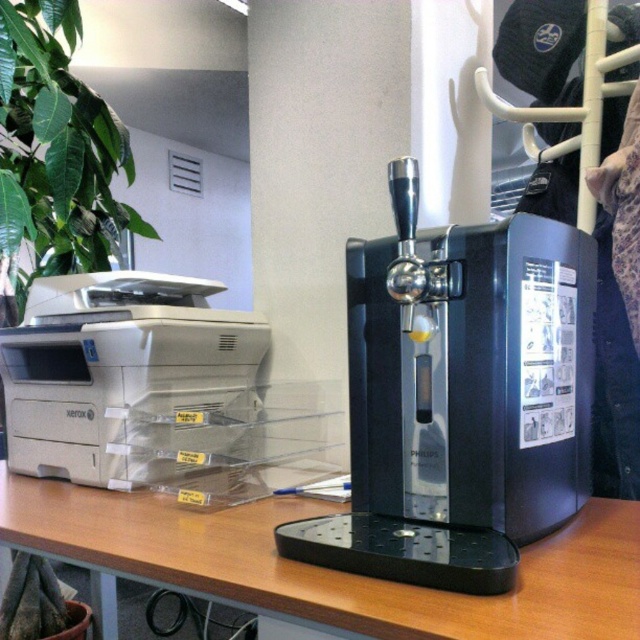
Is brown wood table at center wider than green leafy plant at upper left?

Yes.

Consider the image. Between brown wood table at center and green leafy plant at upper left, which one appears on the left side from the viewer's perspective?

From the viewer's perspective, green leafy plant at upper left appears more on the left side.

Is point (321, 611) positioned after point (106, 184)?

No, (321, 611) is in front of (106, 184).

Find the location of a particular element. brown wood table at center is located at coordinates (326, 568).

The height and width of the screenshot is (640, 640). What do you see at coordinates (460, 397) in the screenshot?
I see `black plastic coffee machine at center` at bounding box center [460, 397].

Can you confirm if black plastic coffee machine at center is thinner than matte gray printer at left?

Yes, black plastic coffee machine at center is thinner than matte gray printer at left.

Is point (371, 410) positioned behind point (147, 273)?

That is False.

Find the location of a particular element. This screenshot has height=640, width=640. black plastic coffee machine at center is located at coordinates (460, 397).

Is black plastic coffee machine at center taller than brown wood table at center?

Yes.

Who is more distant from viewer, (419, 497) or (445, 600)?

Point (419, 497)

Find the location of a particular element. black plastic coffee machine at center is located at coordinates (460, 397).

In order to click on black plastic coffee machine at center in this screenshot , I will do `click(460, 397)`.